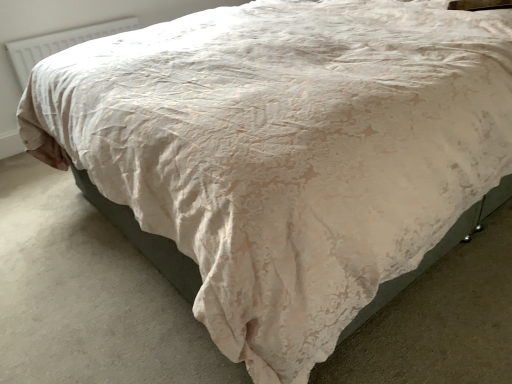
You are a GUI agent. You are given a task and a screenshot of the screen. Output one action in this format:
    pyautogui.click(x=<x>, y=<y>)
    Task: Click on the free space above white plastic radiator at upper left (from a real-world perspective)
    
    Given the screenshot: What is the action you would take?
    pyautogui.click(x=74, y=26)